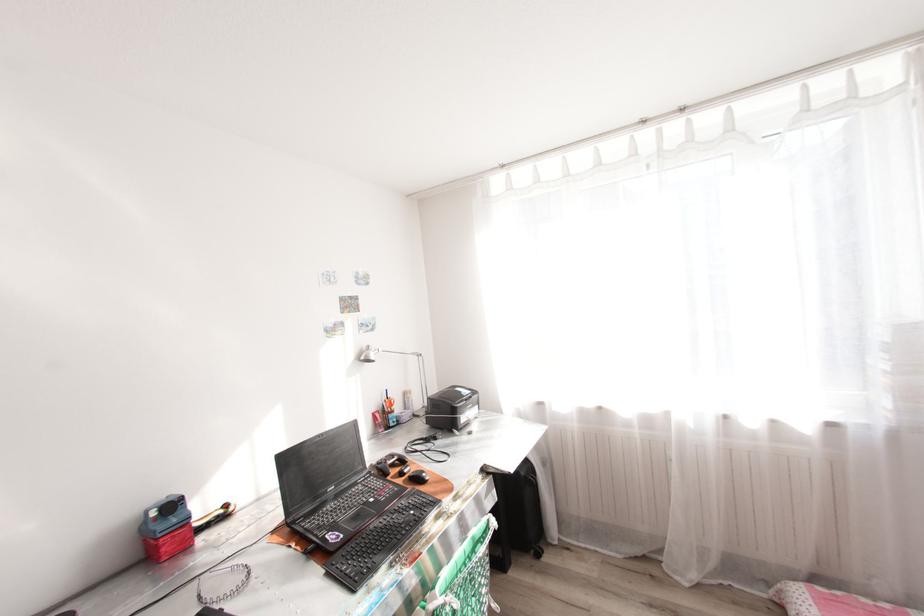
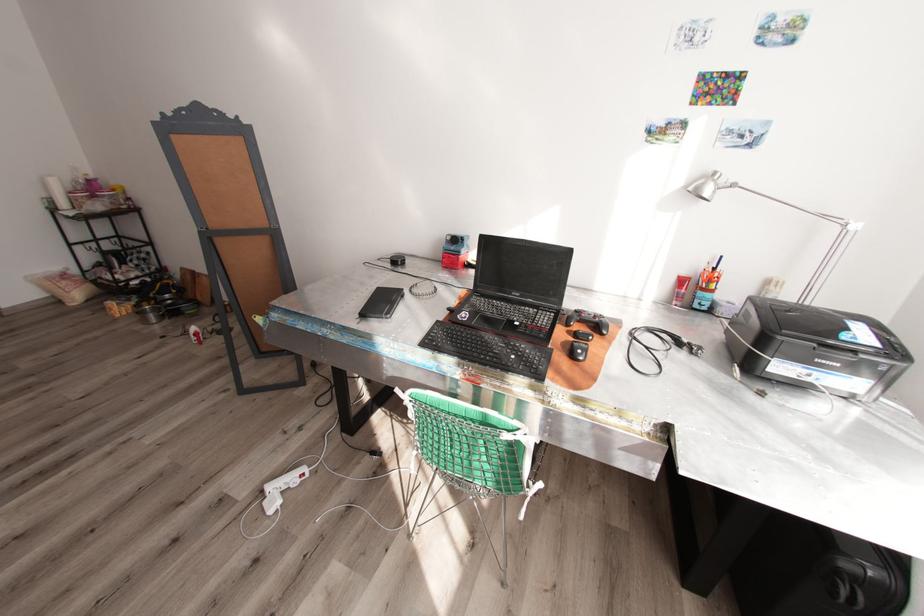
In the second image, find the point that corresponds to point 367,358 in the first image.

(695, 188)